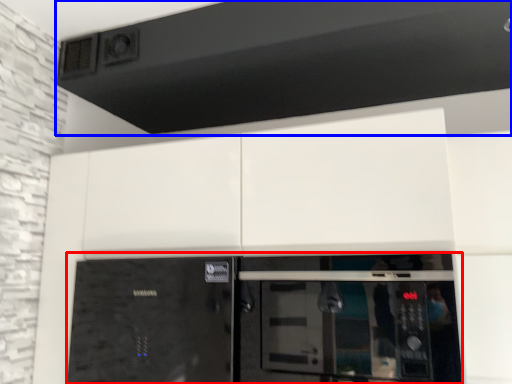
Question: Among these objects, which one is nearest to the camera, home appliance (highlighted by a red box) or exhaust hood (highlighted by a blue box)?

Choices:
 (A) home appliance
 (B) exhaust hood

Answer: (A)